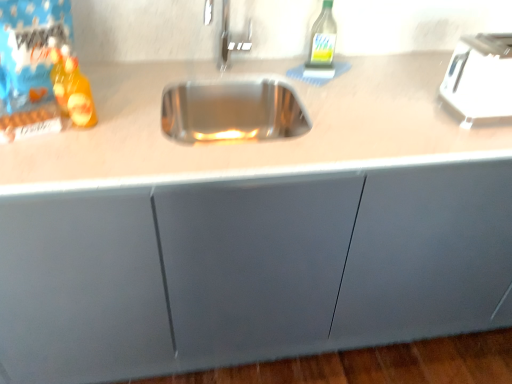
Question: In terms of size, does white plastic toaster at upper right appear bigger or smaller than green glass bottle at upper right, which ranks as the second bottle in front-to-back order?

Choices:
 (A) big
 (B) small

Answer: (A)

Question: Is white plastic toaster at upper right taller or shorter than green glass bottle at upper right, which ranks as the second bottle in left-to-right order?

Choices:
 (A) short
 (B) tall

Answer: (A)

Question: Which is nearer to the translucent plastic bottle at left, which is the 1th bottle from left to right?

Choices:
 (A) white plastic toaster at upper right
 (B) green glass bottle at upper right, which ranks as the second bottle in left-to-right order

Answer: (B)

Question: Based on their relative distances, which object is nearer to the translucent plastic bottle at left, which is the second bottle in top-to-bottom order?

Choices:
 (A) white plastic toaster at upper right
 (B) green glass bottle at upper right, which ranks as the 1th bottle in top-to-bottom order

Answer: (B)